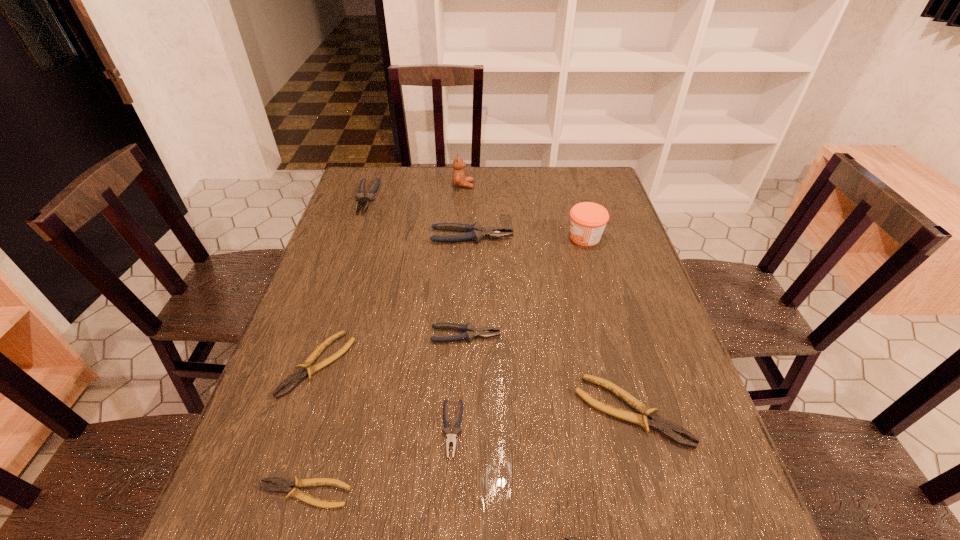
This screenshot has height=540, width=960. Identify the location of yellow pliers that is the second closest to the biggest yellow pliers. [x=283, y=485].

The width and height of the screenshot is (960, 540). What are the coordinates of `free point that satisfies the following two spatial constraints: 1. at the gripping part of the second smallest gray pliers; 2. at the gripping part of the smallest gray pliers` in the screenshot? It's located at (463, 429).

You are a GUI agent. You are given a task and a screenshot of the screen. Output one action in this format:
    pyautogui.click(x=<x>, y=<y>)
    Task: Click on the vacant space that satisfies the following two spatial constraints: 1. on the front label of the jam; 2. at the gripping part of the nearest gray pliers
    
    Given the screenshot: What is the action you would take?
    pyautogui.click(x=639, y=429)

Where is `free spot that satisfies the following two spatial constraints: 1. at the gripping part of the second shortest pliers; 2. on the right side of the seventh shortest pliers`? The image size is (960, 540). free spot that satisfies the following two spatial constraints: 1. at the gripping part of the second shortest pliers; 2. on the right side of the seventh shortest pliers is located at coordinates (266, 493).

Where is `vacant point that satisfies the following two spatial constraints: 1. on the front label of the ninth shortest object; 2. on the front side of the second nearest object`? The height and width of the screenshot is (540, 960). vacant point that satisfies the following two spatial constraints: 1. on the front label of the ninth shortest object; 2. on the front side of the second nearest object is located at coordinates (657, 493).

Image resolution: width=960 pixels, height=540 pixels. In order to click on free region that satisfies the following two spatial constraints: 1. on the face of the teddy bear; 2. on the front side of the seventh farthest pliers in this screenshot , I will do `click(447, 493)`.